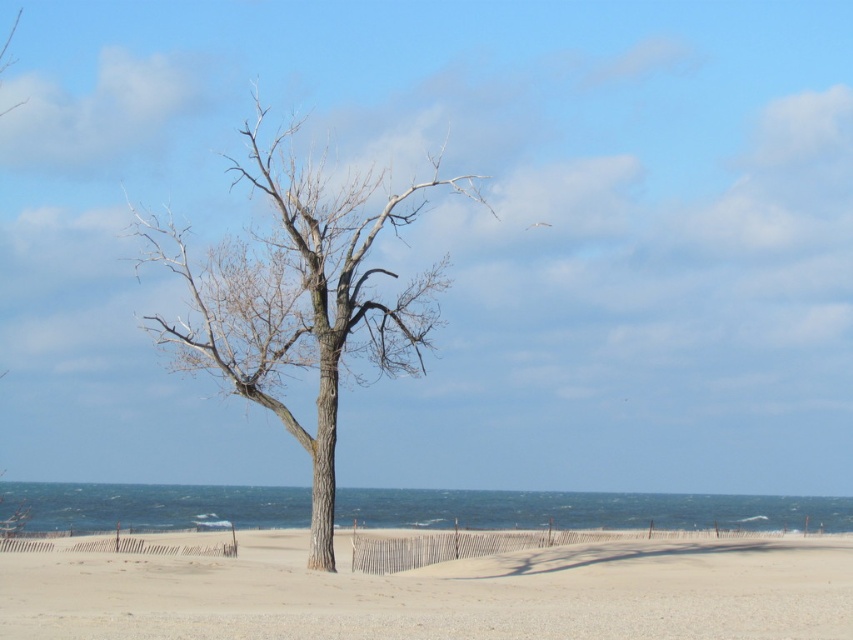
Question: Is smooth sand at center in front of bare wood tree at center?

Choices:
 (A) no
 (B) yes

Answer: (B)

Question: Can you confirm if smooth sand at center is positioned below bare wood tree at center?

Choices:
 (A) yes
 (B) no

Answer: (A)

Question: Which object is closer to the camera taking this photo?

Choices:
 (A) bare wood tree at center
 (B) smooth sand at center

Answer: (B)

Question: Which of the following is the farthest from the observer?

Choices:
 (A) smooth sand at center
 (B) bare wood tree at center

Answer: (B)

Question: Is the position of smooth sand at center more distant than that of bare wood tree at center?

Choices:
 (A) yes
 (B) no

Answer: (B)